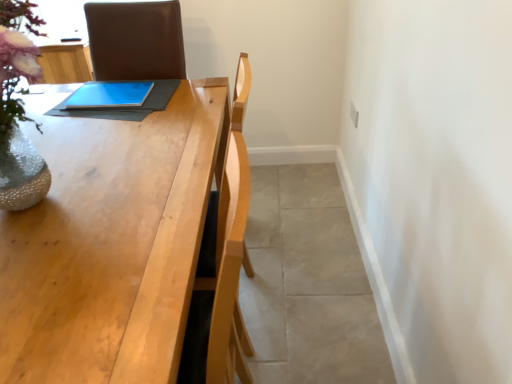
Question: Can you confirm if gray tile floor at lower right is wider than light wood table at center?

Choices:
 (A) yes
 (B) no

Answer: (A)

Question: Considering the relative sizes of gray tile floor at lower right and light wood table at center in the image provided, is gray tile floor at lower right taller than light wood table at center?

Choices:
 (A) no
 (B) yes

Answer: (A)

Question: Is gray tile floor at lower right turned away from light wood table at center?

Choices:
 (A) yes
 (B) no

Answer: (B)

Question: From the image's perspective, does gray tile floor at lower right appear higher than light wood table at center?

Choices:
 (A) yes
 (B) no

Answer: (A)

Question: Is gray tile floor at lower right not within light wood table at center?

Choices:
 (A) no
 (B) yes

Answer: (B)

Question: Looking at their shapes, would you say light wood table at center is wider or thinner than gray tile floor at lower right?

Choices:
 (A) thin
 (B) wide

Answer: (A)

Question: Is light wood table at center spatially inside gray tile floor at lower right, or outside of it?

Choices:
 (A) outside
 (B) inside

Answer: (A)

Question: Is light wood table at center taller or shorter than gray tile floor at lower right?

Choices:
 (A) short
 (B) tall

Answer: (B)

Question: From a real-world perspective, is light wood table at center above or below gray tile floor at lower right?

Choices:
 (A) above
 (B) below

Answer: (A)

Question: Considering the positions of point pyautogui.click(x=251, y=177) and point pyautogui.click(x=95, y=104), is point pyautogui.click(x=251, y=177) closer or farther from the camera than point pyautogui.click(x=95, y=104)?

Choices:
 (A) farther
 (B) closer

Answer: (A)

Question: From the image's perspective, relative to blue matte tablet at center, is gray tile floor at lower right above or below?

Choices:
 (A) above
 (B) below

Answer: (B)

Question: Considering the positions of gray tile floor at lower right and blue matte tablet at center in the image, is gray tile floor at lower right bigger or smaller than blue matte tablet at center?

Choices:
 (A) small
 (B) big

Answer: (B)

Question: Is gray tile floor at lower right inside or outside of blue matte tablet at center?

Choices:
 (A) outside
 (B) inside

Answer: (A)

Question: Considering the positions of blue matte tablet at center and light wood table at center in the image, is blue matte tablet at center wider or thinner than light wood table at center?

Choices:
 (A) wide
 (B) thin

Answer: (B)

Question: From the image's perspective, relative to light wood table at center, is blue matte tablet at center above or below?

Choices:
 (A) above
 (B) below

Answer: (A)